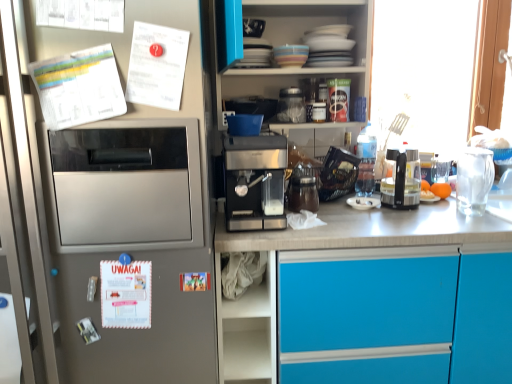
Locate an element on the screen. This screenshot has height=384, width=512. black plastic coffee machine at center is located at coordinates (402, 180).

Find the location of a particular element. The image size is (512, 384). white glossy cabinet at upper center is located at coordinates (302, 43).

In order to face white glossy cabinet at upper center, should I rotate leftwards or rightwards?

Rotate right and turn 6.356 degrees.

Locate an element on the screen. This screenshot has width=512, height=384. white paper at left, the second postcard from the bottom is located at coordinates (79, 87).

Is satin silver refrigerator at left looking in the opposite direction of transparent glass window at right?

No, transparent glass window at right is not at the back of satin silver refrigerator at left.

From a real-world perspective, is satin silver refrigerator at left above or below transparent glass window at right?

From a real-world perspective, satin silver refrigerator at left is physically below transparent glass window at right.

Can you confirm if satin silver refrigerator at left is shorter than transparent glass window at right?

In fact, satin silver refrigerator at left may be taller than transparent glass window at right.

Which object is positioned more to the left, satin silver refrigerator at left or transparent glass window at right?

satin silver refrigerator at left.

Is sleek metallic espresso machine at center turned away from white paper at upper left, which is the first postcard in top-to-bottom order?

No, sleek metallic espresso machine at center is not facing away from white paper at upper left, which is the first postcard in top-to-bottom order.

Is sleek metallic espresso machine at center not inside white paper at upper left, the 3th postcard positioned from the bottom?

Absolutely, sleek metallic espresso machine at center is external to white paper at upper left, the 3th postcard positioned from the bottom.

Is sleek metallic espresso machine at center at the right side of white paper at upper left, the 3th postcard positioned from the bottom?

Yes, sleek metallic espresso machine at center is to the right of white paper at upper left, the 3th postcard positioned from the bottom.

Which of these two, sleek metallic espresso machine at center or white paper at upper left, the 3th postcard positioned from the bottom, is smaller?

With smaller size is white paper at upper left, the 3th postcard positioned from the bottom.

Which is more distant, (255, 275) or (292, 62)?

The point (292, 62) is more distant.

From the image's perspective, does white fabric at lower center appear lower than matte ceramic bowl at upper center, positioned as the 3th appliance in bottom-to-top order?

Yes, from the image's perspective, white fabric at lower center is below matte ceramic bowl at upper center, positioned as the 3th appliance in bottom-to-top order.

Is white fabric at lower center beside matte ceramic bowl at upper center, positioned as the 3th appliance in bottom-to-top order?

white fabric at lower center and matte ceramic bowl at upper center, positioned as the 3th appliance in bottom-to-top order, are clearly separated.

Which object is thinner, white paper at left, the second postcard from the bottom, or white fabric at lower center?

With smaller width is white paper at left, the second postcard from the bottom.

Can you confirm if white paper at left, the second postcard from the bottom, is smaller than white fabric at lower center?

Yes, white paper at left, the second postcard from the bottom, is smaller than white fabric at lower center.

Is white paper at left, the second postcard from the bottom, facing towards white fabric at lower center?

No, white paper at left, the second postcard from the bottom, does not turn towards white fabric at lower center.

Where is `shelf on the right of the white paper at left, the second postcard from the bottom`? Image resolution: width=512 pixels, height=384 pixels. shelf on the right of the white paper at left, the second postcard from the bottom is located at coordinates (252, 293).

Visually, is blue matte cabinet at center positioned to the left or to the right of sleek metallic espresso machine at center?

From the image, it's evident that blue matte cabinet at center is to the right of sleek metallic espresso machine at center.

Considering the sizes of objects blue matte cabinet at center and sleek metallic espresso machine at center in the image provided, who is wider, blue matte cabinet at center or sleek metallic espresso machine at center?

With larger width is blue matte cabinet at center.

Is point (477, 349) closer or farther from the camera than point (284, 220)?

Point (477, 349) is positioned closer to the camera compared to point (284, 220).

From the image's perspective, which one is positioned higher, blue matte cabinet at center or sleek metallic espresso machine at center?

sleek metallic espresso machine at center appears higher in the image.

Based on the photo, is black plastic coffee machine at center wider or thinner than orange matte fruit at right?

black plastic coffee machine at center is wider than orange matte fruit at right.

Does black plastic coffee machine at center turn towards orange matte fruit at right?

No, black plastic coffee machine at center is not turned towards orange matte fruit at right.

Where is `coffee machine lying on the left of orange matte fruit at right`? This screenshot has height=384, width=512. coffee machine lying on the left of orange matte fruit at right is located at coordinates (402, 180).

From a real-world perspective, is black plastic coffee machine at center physically located above or below orange matte fruit at right?

From a real-world perspective, black plastic coffee machine at center is physically above orange matte fruit at right.

Is orange matte fruit at right aimed at black plastic coffee machine at center?

No.

Considering the relative sizes of orange matte fruit at right and black plastic coffee machine at center in the image provided, is orange matte fruit at right bigger than black plastic coffee machine at center?

No.

Between orange matte fruit at right and black plastic coffee machine at center, which one is positioned in front?

Positioned in front is black plastic coffee machine at center.

Looking at their sizes, would you say orange matte fruit at right is wider or thinner than black plastic coffee machine at center?

orange matte fruit at right is thinner than black plastic coffee machine at center.

At what (x,y) coordinates should I click in order to perform the action: click on refrigerator that appears on the left of transparent glass window at right. Please return your answer as a coordinate pair (x, y). Looking at the image, I should click on (124, 233).

Locate an element on the screen. kitchen appliance located below the white paper at upper left, the 3th postcard positioned from the bottom (from the image's perspective) is located at coordinates (255, 182).

Looking at the image, which one is located further to orange matte fruit at right, white paper at left, the second postcard from the top, or matte ceramic bowl at upper center, positioned as the 3th appliance in bottom-to-top order?

Based on the image, white paper at left, the second postcard from the top, appears to be further to orange matte fruit at right.

Considering their positions, is matte ceramic bowl at upper center, positioned as the 3th appliance in bottom-to-top order, positioned further to white paper at upper left, the 3th postcard positioned from the bottom, than white paper at left, the 1th postcard when ordered from bottom to top?

matte ceramic bowl at upper center, positioned as the 3th appliance in bottom-to-top order, is further to white paper at upper left, the 3th postcard positioned from the bottom.

Considering their positions, is transparent glass window at right positioned further to orange matte fruit at right than brown matte jar at center, marked as the 1th appliance in a bottom-to-top arrangement?

transparent glass window at right is positioned further to the anchor orange matte fruit at right.

Which object lies further to the anchor point brown matte jar at center, marked as the 3th appliance in a top-to-bottom arrangement, black plastic coffee machine at center or satin silver refrigerator at left?

satin silver refrigerator at left is positioned further to the anchor brown matte jar at center, marked as the 3th appliance in a top-to-bottom arrangement.

Which object lies further to the anchor point sleek metallic espresso machine at center, orange matte fruit at right or transparent glass window at right?

The object further to sleek metallic espresso machine at center is transparent glass window at right.

From the image, which object appears to be farther from white glossy cabinet at upper center, brown matte jar at center, marked as the 1th appliance in a bottom-to-top arrangement, or white paper at upper left, the 3th postcard positioned from the bottom?

white paper at upper left, the 3th postcard positioned from the bottom.

Estimate the real-world distances between objects in this image. Which object is further from black plastic coffee machine at center, brown matte jar at center, marked as the 3th appliance in a top-to-bottom arrangement, or blue matte cabinet at center?

Among the two, blue matte cabinet at center is located further to black plastic coffee machine at center.

Based on their spatial positions, is orange matte fruit at right or transparent glass window at right closer to matte ceramic bowl at upper center, positioned as the 3th appliance in bottom-to-top order?

orange matte fruit at right.

What are the coordinates of `kitchen appliance located between white glossy cabinet at upper center and metallic silver coffee machine at upper center, which ranks as the second appliance in top-to-bottom order, in the depth direction` in the screenshot? It's located at (255, 182).

The width and height of the screenshot is (512, 384). I want to click on postcard between white paper at left, the 1th postcard when ordered from bottom to top, and orange matte fruit at right, in the horizontal direction, so click(x=157, y=66).

Where is `food between transparent glass window at right and blue matte cabinet at center from top to bottom`? The image size is (512, 384). food between transparent glass window at right and blue matte cabinet at center from top to bottom is located at coordinates (434, 190).

At what (x,y) coordinates should I click in order to perform the action: click on postcard located between white paper at left, the 1th postcard when ordered from bottom to top, and blue matte cabinet at center in the left-right direction. Please return your answer as a coordinate pair (x, y). This screenshot has width=512, height=384. Looking at the image, I should click on (157, 66).